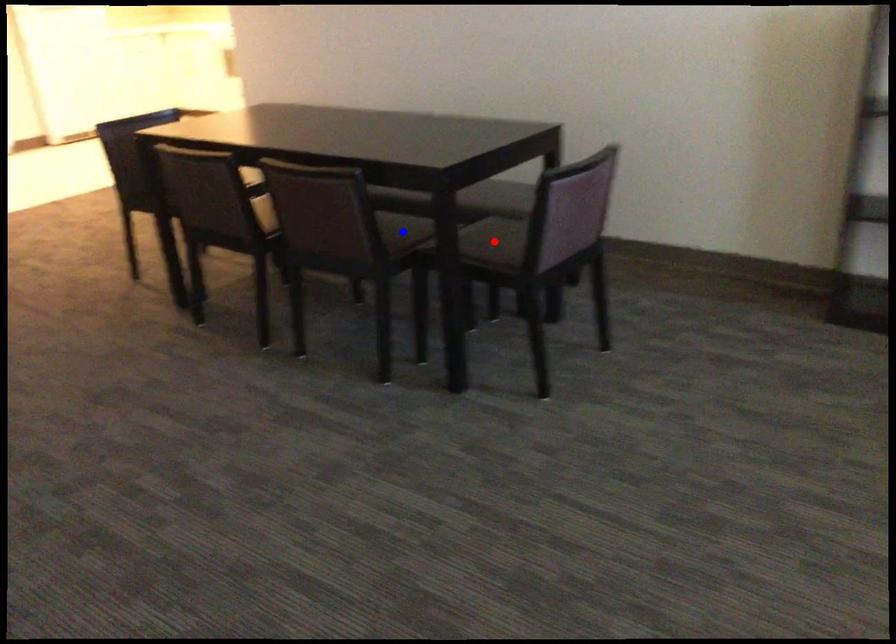
Question: Which of the two points in the image is closer to the camera?

Choices:
 (A) Blue point is closer.
 (B) Red point is closer.

Answer: (B)